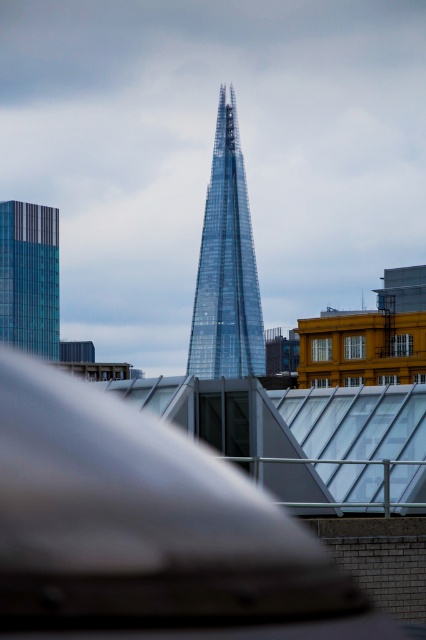
Question: Can you confirm if transparent glass tower at center is bigger than glassy teal skyscraper at left?

Choices:
 (A) no
 (B) yes

Answer: (B)

Question: Does transparent glass tower at center have a larger size compared to glassy teal skyscraper at left?

Choices:
 (A) no
 (B) yes

Answer: (B)

Question: Does transparent glass tower at center have a lesser width compared to glassy teal skyscraper at left?

Choices:
 (A) no
 (B) yes

Answer: (A)

Question: Among these points, which one is farthest from the camera?

Choices:
 (A) (235, 259)
 (B) (48, 212)

Answer: (B)